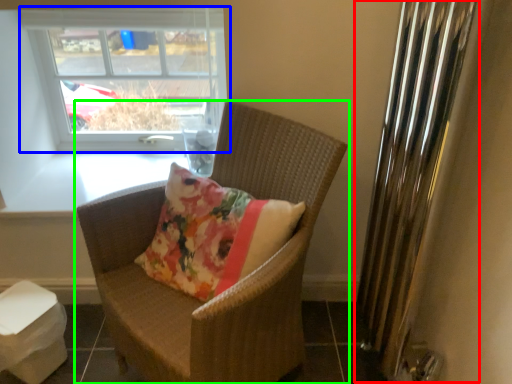
Question: Estimate the real-world distances between objects in this image. Which object is farther from radiator (highlighted by a red box), window (highlighted by a blue box) or chair (highlighted by a green box)?

Choices:
 (A) window
 (B) chair

Answer: (A)